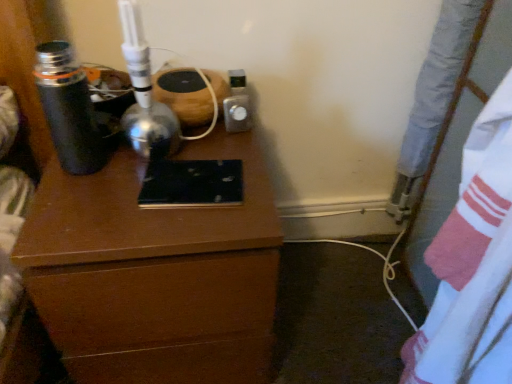
Question: Is white cotton sheet at right shorter than metallic silver thermos at left?

Choices:
 (A) yes
 (B) no

Answer: (B)

Question: From the image's perspective, is white cotton sheet at right beneath metallic silver thermos at left?

Choices:
 (A) yes
 (B) no

Answer: (A)

Question: Is white cotton sheet at right behind metallic silver thermos at left?

Choices:
 (A) no
 (B) yes

Answer: (A)

Question: Would you consider white cotton sheet at right to be distant from metallic silver thermos at left?

Choices:
 (A) yes
 (B) no

Answer: (B)

Question: Can you confirm if white cotton sheet at right is positioned to the left of metallic silver thermos at left?

Choices:
 (A) yes
 (B) no

Answer: (B)

Question: Is brown wood chest of drawers at center bigger or smaller than metallic silver thermos at left?

Choices:
 (A) small
 (B) big

Answer: (B)

Question: Looking at their shapes, would you say brown wood chest of drawers at center is wider or thinner than metallic silver thermos at left?

Choices:
 (A) thin
 (B) wide

Answer: (B)

Question: From a real-world perspective, is brown wood chest of drawers at center above or below metallic silver thermos at left?

Choices:
 (A) below
 (B) above

Answer: (A)

Question: In the image, is brown wood chest of drawers at center on the left side or the right side of metallic silver thermos at left?

Choices:
 (A) right
 (B) left

Answer: (A)

Question: From their relative heights in the image, would you say metallic silver thermos at left is taller or shorter than brown wood chest of drawers at center?

Choices:
 (A) tall
 (B) short

Answer: (B)

Question: Looking at their shapes, would you say metallic silver thermos at left is wider or thinner than brown wood chest of drawers at center?

Choices:
 (A) thin
 (B) wide

Answer: (A)

Question: Is metallic silver thermos at left bigger or smaller than brown wood chest of drawers at center?

Choices:
 (A) small
 (B) big

Answer: (A)

Question: Does point (74, 117) appear closer or farther from the camera than point (241, 352)?

Choices:
 (A) closer
 (B) farther

Answer: (A)

Question: Is point (136, 160) positioned closer to the camera than point (470, 360)?

Choices:
 (A) closer
 (B) farther

Answer: (B)

Question: Is brown wood chest of drawers at center situated inside white cotton sheet at right or outside?

Choices:
 (A) inside
 (B) outside

Answer: (B)